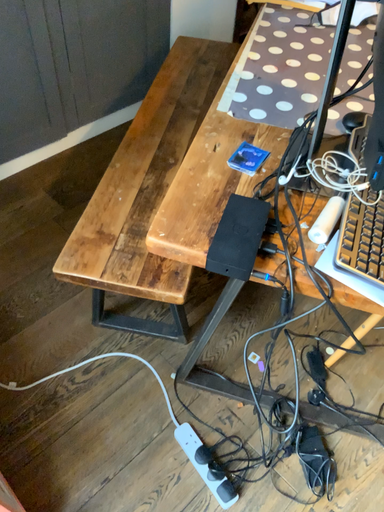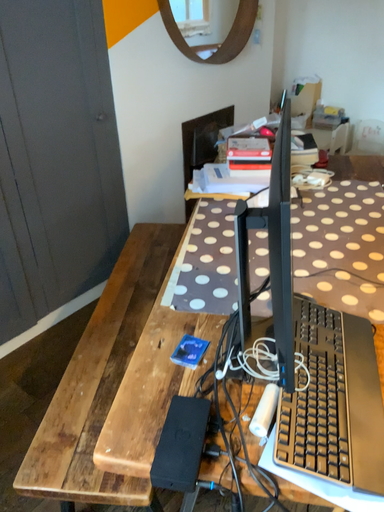
Question: Which way did the camera rotate in the video?

Choices:
 (A) rotated downward
 (B) rotated upward

Answer: (B)